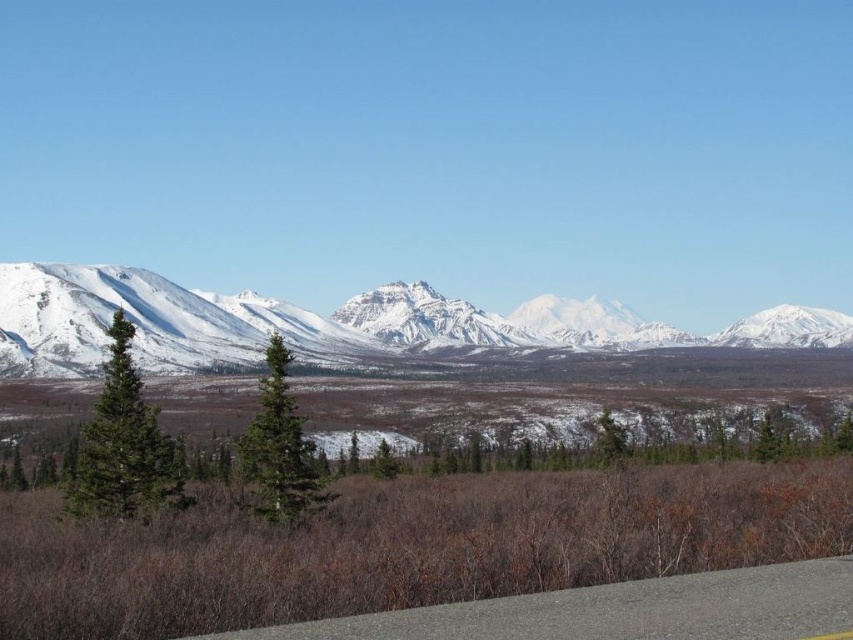
Is snowy granite mountains at center shorter than gray asphalt road at lower center?

Incorrect, snowy granite mountains at center's height does not fall short of gray asphalt road at lower center's.

The image size is (853, 640). What do you see at coordinates (315, 324) in the screenshot?
I see `snowy granite mountains at center` at bounding box center [315, 324].

You are a GUI agent. You are given a task and a screenshot of the screen. Output one action in this format:
    pyautogui.click(x=<x>, y=<y>)
    Task: Click on the snowy granite mountains at center
    
    Given the screenshot: What is the action you would take?
    pyautogui.click(x=315, y=324)